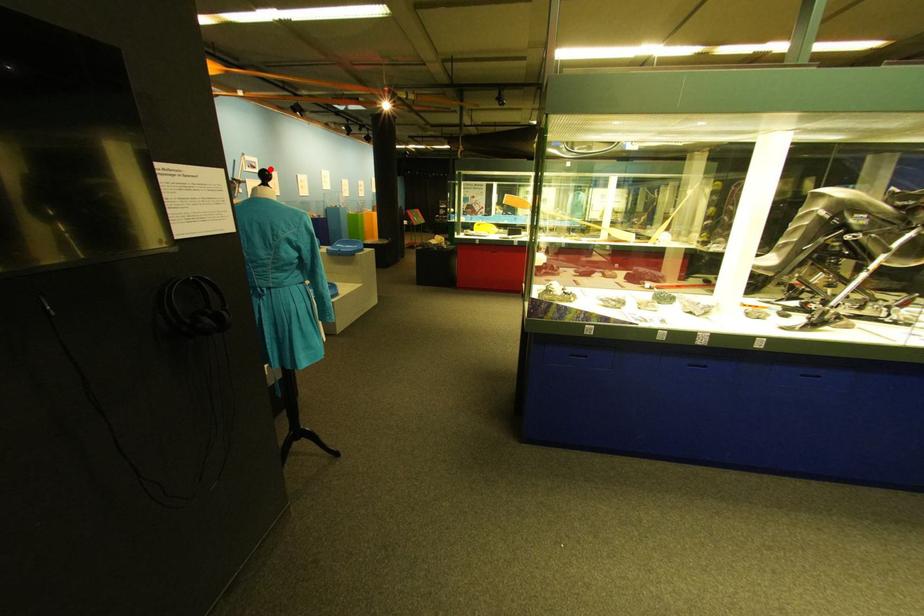
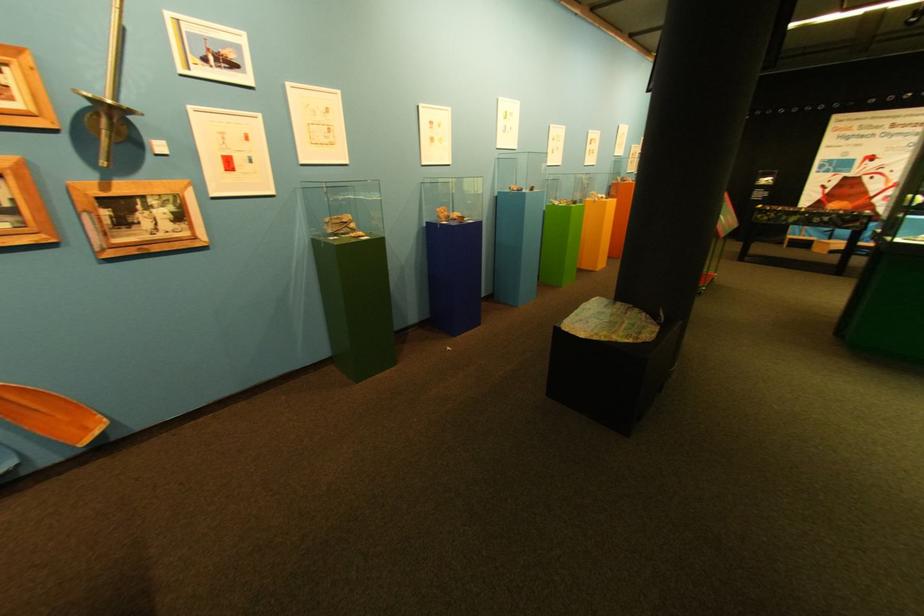
Find the pixel in the second image that matches the highlighted location in the first image.

(248, 67)